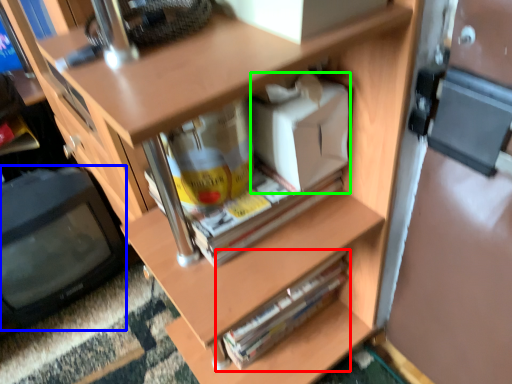
Question: Estimate the real-world distances between objects in this image. Which object is farther from paperback book (highlighted by a red box), computer monitor (highlighted by a blue box) or box (highlighted by a green box)?

Choices:
 (A) computer monitor
 (B) box

Answer: (A)